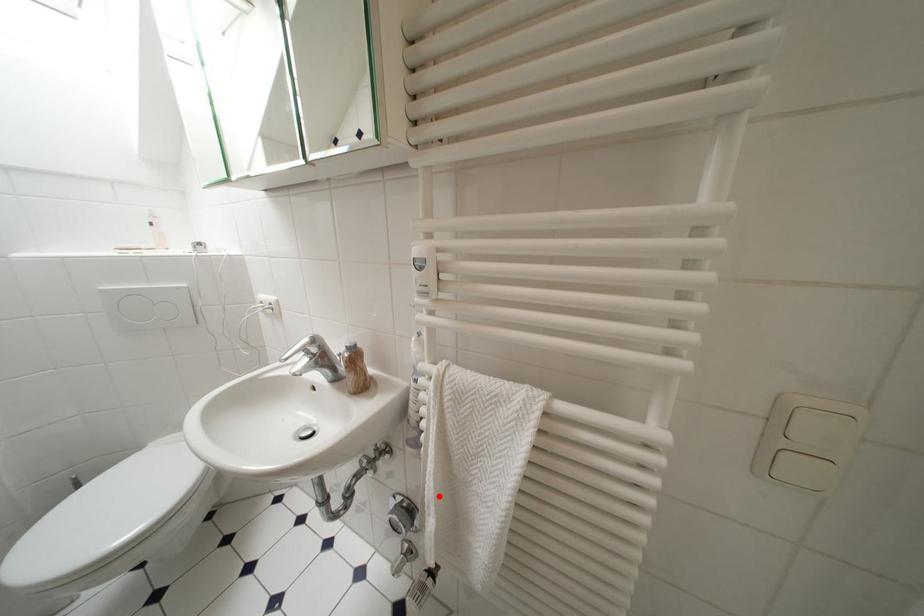
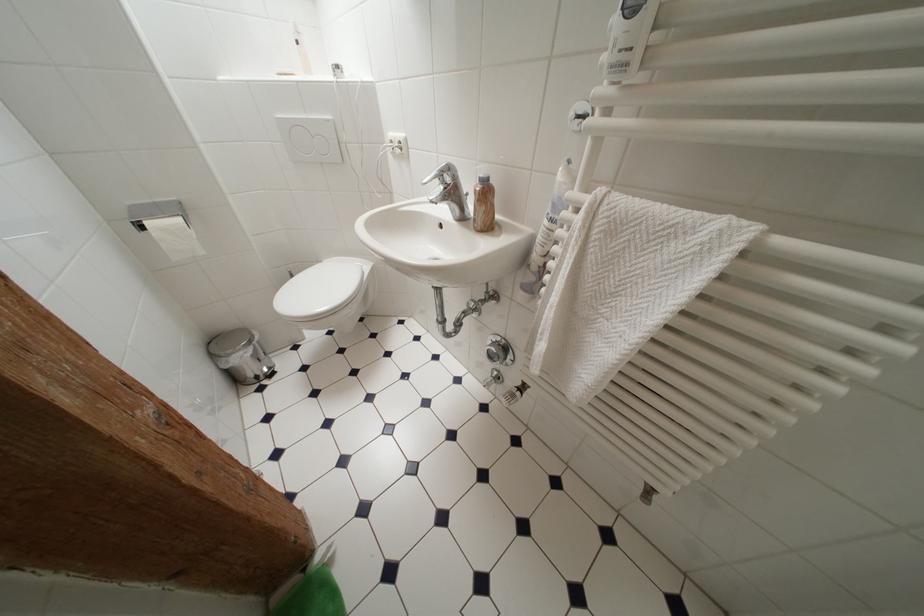
The point at the highlighted location is marked in the first image. Where is the corresponding point in the second image?

(555, 325)